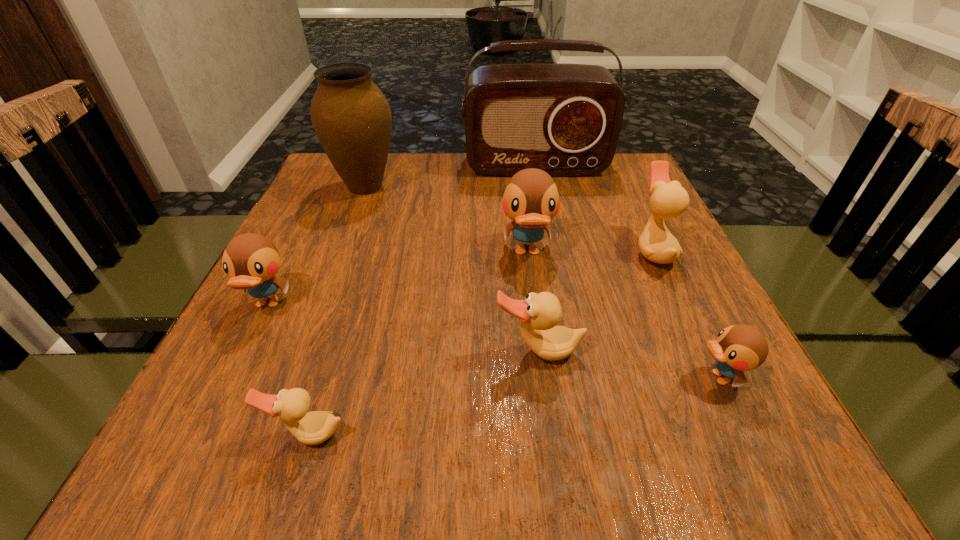
Locate an element on the screen. This screenshot has width=960, height=540. radio receiver is located at coordinates (565, 119).

This screenshot has width=960, height=540. Find the location of `brown urn`. brown urn is located at coordinates (352, 118).

Where is `the farthest blue duck`? the farthest blue duck is located at coordinates (531, 199).

At what (x,y) coordinates should I click in order to perform the action: click on the biggest blue duck. Please return your answer as a coordinate pair (x, y). This screenshot has height=540, width=960. Looking at the image, I should click on (531, 199).

I want to click on the biggest tan duck, so click(x=669, y=199).

Where is `the rightmost tan duck`? the rightmost tan duck is located at coordinates (669, 199).

Where is `the second biggest blue duck`? The image size is (960, 540). the second biggest blue duck is located at coordinates (251, 261).

I want to click on the fourth nearest duck, so pos(251,261).

At what (x,y) coordinates should I click in order to perform the action: click on the second tan duck from left to right. Please return your answer as a coordinate pair (x, y). This screenshot has height=540, width=960. Looking at the image, I should click on (539, 313).

The width and height of the screenshot is (960, 540). I want to click on the second smallest tan duck, so click(x=539, y=313).